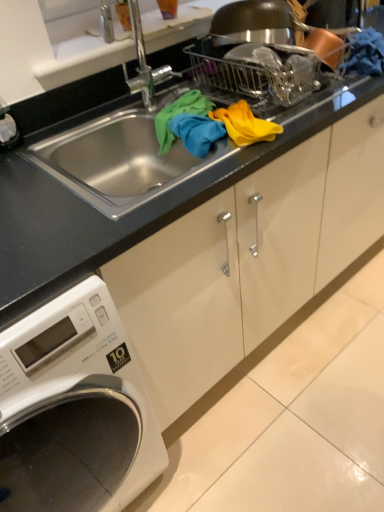
Question: Is black granite countertop at center next to white glossy washing machine at lower left?

Choices:
 (A) yes
 (B) no

Answer: (B)

Question: From the image's perspective, is black granite countertop at center on white glossy washing machine at lower left?

Choices:
 (A) no
 (B) yes

Answer: (B)

Question: Is black granite countertop at center outside white glossy washing machine at lower left?

Choices:
 (A) yes
 (B) no

Answer: (A)

Question: From a real-world perspective, is black granite countertop at center physically above white glossy washing machine at lower left?

Choices:
 (A) no
 (B) yes

Answer: (B)

Question: Does black granite countertop at center appear on the left side of white glossy washing machine at lower left?

Choices:
 (A) no
 (B) yes

Answer: (A)

Question: Considering the relative positions of black granite countertop at center and white glossy washing machine at lower left in the image provided, is black granite countertop at center to the right of white glossy washing machine at lower left from the viewer's perspective?

Choices:
 (A) no
 (B) yes

Answer: (B)

Question: Is black granite countertop at center positioned beyond the bounds of yellow fabric at upper center?

Choices:
 (A) yes
 (B) no

Answer: (A)

Question: Considering the relative sizes of black granite countertop at center and yellow fabric at upper center in the image provided, is black granite countertop at center taller than yellow fabric at upper center?

Choices:
 (A) yes
 (B) no

Answer: (A)

Question: From a real-world perspective, is black granite countertop at center located beneath yellow fabric at upper center?

Choices:
 (A) yes
 (B) no

Answer: (B)

Question: Does black granite countertop at center appear on the right side of yellow fabric at upper center?

Choices:
 (A) yes
 (B) no

Answer: (B)

Question: Is the depth of black granite countertop at center less than that of yellow fabric at upper center?

Choices:
 (A) yes
 (B) no

Answer: (A)

Question: Is yellow fabric at upper center at the back of black granite countertop at center?

Choices:
 (A) yes
 (B) no

Answer: (A)

Question: Is yellow fabric at upper center next to black granite countertop at center?

Choices:
 (A) yes
 (B) no

Answer: (B)